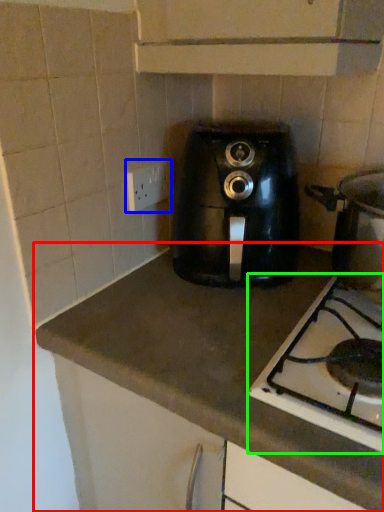
Question: Which object is positioned farthest from countertop (highlighted by a red box)? Select from electric outlet (highlighted by a blue box) and gas stove (highlighted by a green box).

Choices:
 (A) electric outlet
 (B) gas stove

Answer: (A)